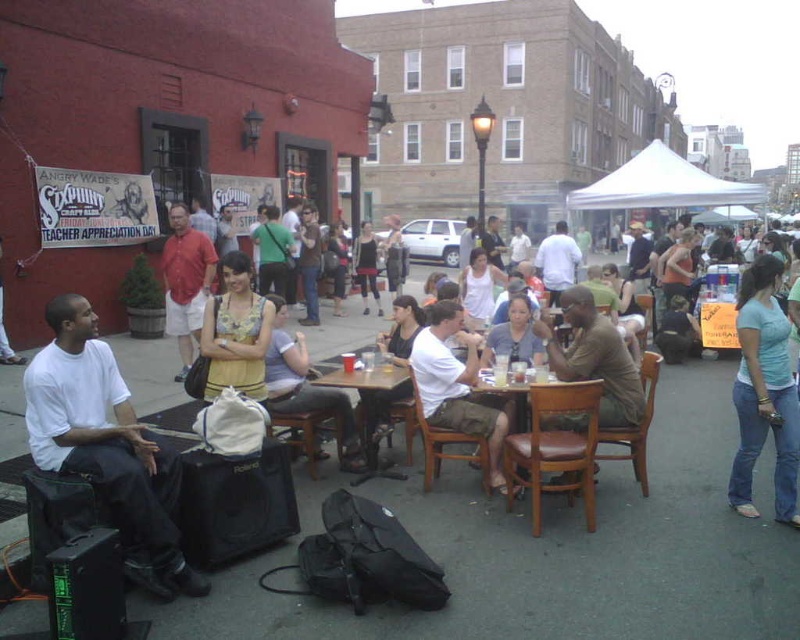
You are a photographer at the event and need to capture a clear shot of the brown leather table at center without any people blocking it. However, there are light blue denim jeans at lower right currently in the frame. What should you do?

The light blue denim jeans at lower right is positioned over the brown leather table at center, so you should move the light blue denim jeans at lower right to get a clear shot of the brown leather table at center.

You are a photographer at the event and want to take a photo of the brown leather table at center without including the white matte shirt at left in the frame. Is this possible based on their positions?

The white matte shirt at left is in front of the brown leather table at center, so it would block the view. To capture the brown leather table at center without the white matte shirt at left, you would need to move around the shirt or adjust your angle to ensure it is not in the line of sight.